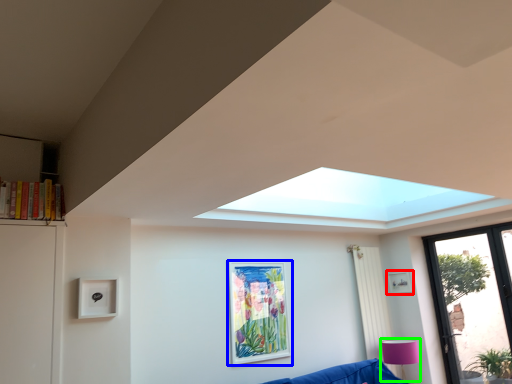
Question: Which is farther away from picture frame (highlighted by a red box)? picture frame (highlighted by a blue box) or lamp (highlighted by a green box)?

Choices:
 (A) picture frame
 (B) lamp

Answer: (A)